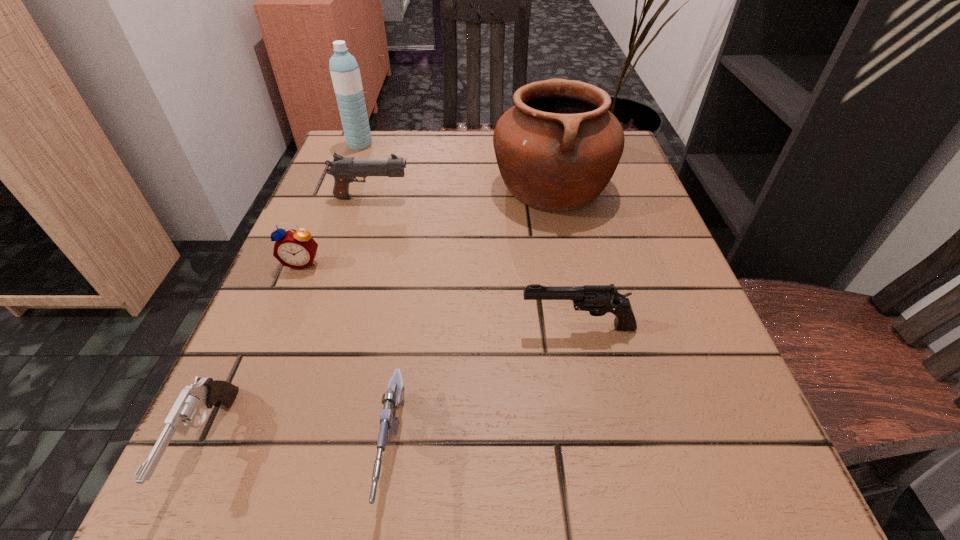
What are the coordinates of `pottery that is at the right edge` in the screenshot? It's located at (557, 149).

Where is `gun at the right edge`? Image resolution: width=960 pixels, height=540 pixels. gun at the right edge is located at coordinates (597, 299).

Find the location of a particular element. object that is at the far left corner is located at coordinates (x=345, y=73).

Find the location of a particular element. object at the near left corner is located at coordinates (205, 393).

This screenshot has width=960, height=540. I want to click on object located in the far right corner section of the desktop, so click(x=557, y=149).

You are a GUI agent. You are given a task and a screenshot of the screen. Output one action in this format:
    pyautogui.click(x=<x>, y=<y>)
    Task: Click on the free space at the far edge
    The image size is (960, 540).
    Given the screenshot: What is the action you would take?
    (467, 160)

In the image, there is a desktop. At what (x,y) coordinates should I click in order to perform the action: click on vacant space at the near edge. Please return your answer as a coordinate pair (x, y). The image size is (960, 540). Looking at the image, I should click on (583, 469).

The image size is (960, 540). Identify the location of free space at the left edge of the desktop. (342, 381).

Where is `vacant space at the right edge of the desktop`? vacant space at the right edge of the desktop is located at coordinates (664, 418).

The height and width of the screenshot is (540, 960). In the image, there is a desktop. In order to click on vacant space at the far left corner in this screenshot , I will do `click(397, 137)`.